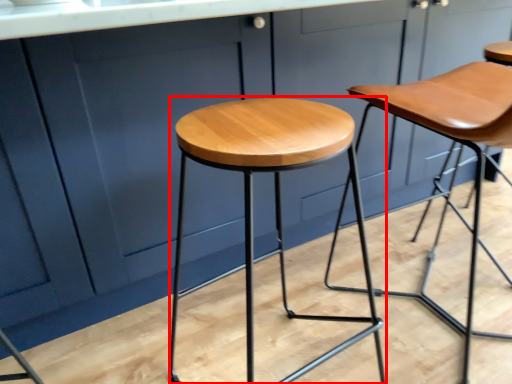
Question: Where is stool (annotated by the red box) located in relation to stool in the image?

Choices:
 (A) left
 (B) right

Answer: (A)